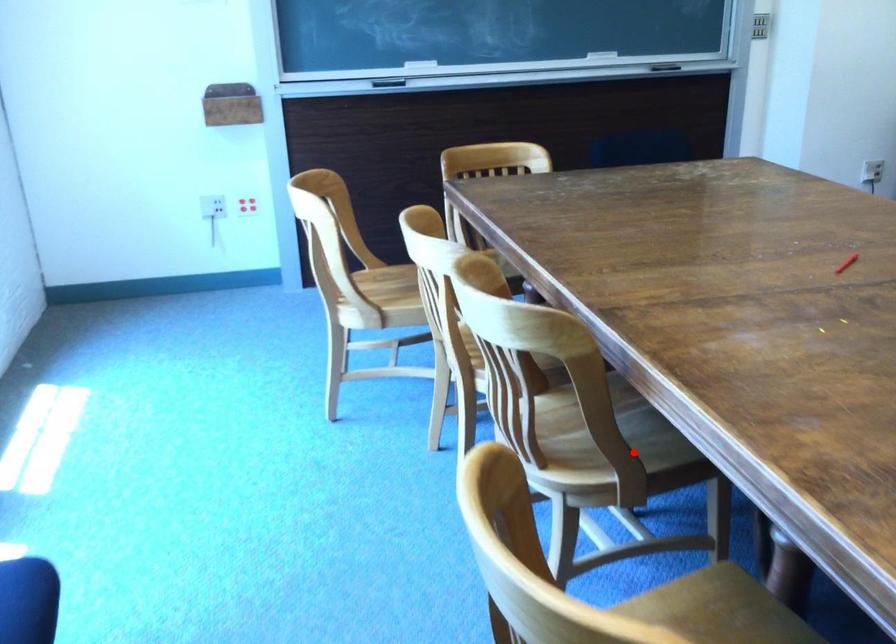
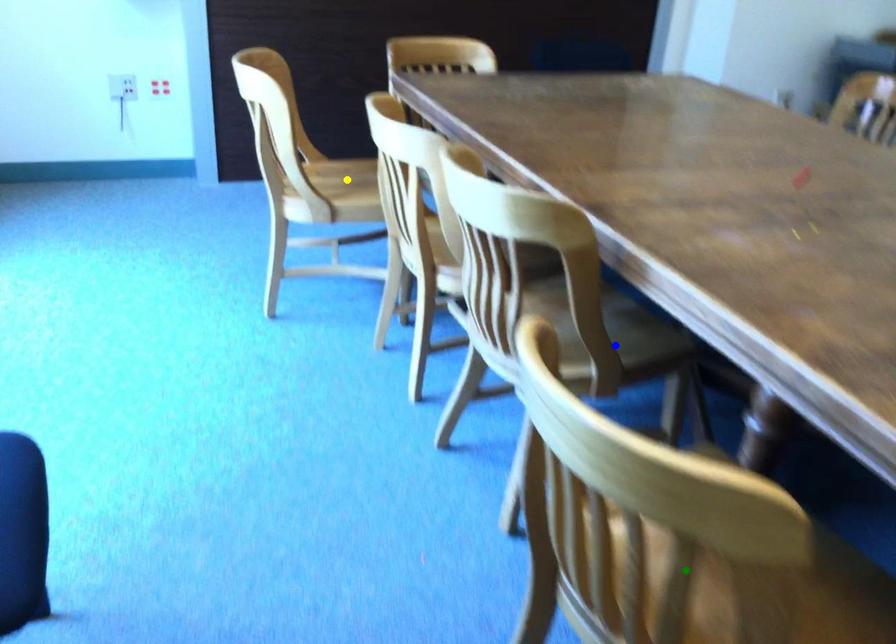
Question: I am providing you with two images of the same scene from different viewpoints. A red point is marked on the first image. You are given multiple points on the second image. In image 2, which mark is for the same physical point as the one in image 1?

Choices:
 (A) green point
 (B) yellow point
 (C) blue point

Answer: (C)